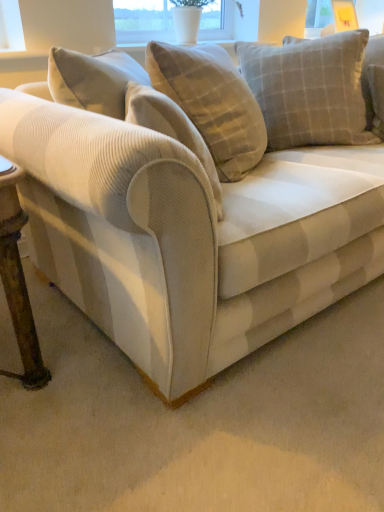
Question: In terms of size, does velvet beige couch at center appear bigger or smaller than light gray checkered cushion at upper right?

Choices:
 (A) small
 (B) big

Answer: (B)

Question: Do you think velvet beige couch at center is within light gray checkered cushion at upper right, or outside of it?

Choices:
 (A) inside
 (B) outside

Answer: (B)

Question: Based on their relative distances, which object is farther from the velvet beige couch at center?

Choices:
 (A) transparent glass window screen at upper center
 (B) light gray checkered cushion at upper right

Answer: (A)

Question: Estimate the real-world distances between objects in this image. Which object is farther from the transparent glass window screen at upper center?

Choices:
 (A) light gray checkered cushion at upper right
 (B) velvet beige couch at center

Answer: (B)